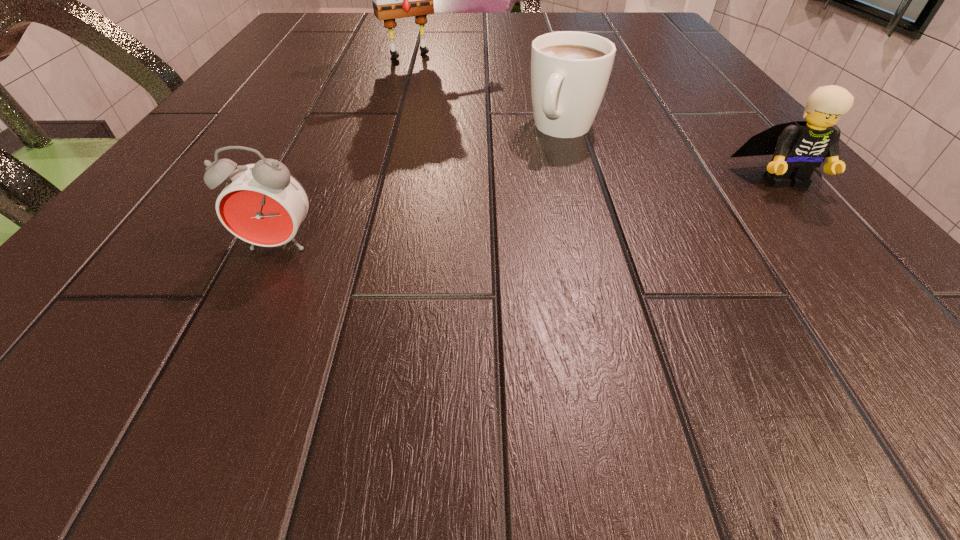
In the image, there is a desktop. In order to click on vacant region at the near edge in this screenshot , I will do `click(507, 274)`.

The height and width of the screenshot is (540, 960). In order to click on blank area at the left edge in this screenshot , I will do `click(304, 68)`.

The image size is (960, 540). In the image, there is a desktop. What are the coordinates of `vacant region at the right edge` in the screenshot? It's located at (804, 219).

The image size is (960, 540). I want to click on free space at the near left corner of the desktop, so click(x=170, y=254).

Locate an element on the screen. This screenshot has width=960, height=540. vacant space at the far right corner is located at coordinates (629, 35).

I want to click on free spot between the rightmost object and the tallest object, so click(596, 117).

The height and width of the screenshot is (540, 960). What are the coordinates of `free spot between the alarm clock and the farthest object` in the screenshot? It's located at (345, 150).

You are a GUI agent. You are given a task and a screenshot of the screen. Output one action in this format:
    pyautogui.click(x=<x>, y=<y>)
    Task: Click on the blank region between the sponge and the second farthest object
    
    Given the screenshot: What is the action you would take?
    pyautogui.click(x=487, y=92)

Find the location of a particular element. This screenshot has width=960, height=540. free point between the sponge and the alarm clock is located at coordinates (345, 150).

The image size is (960, 540). Find the location of `free point between the tallest object and the alarm clock`. free point between the tallest object and the alarm clock is located at coordinates (345, 150).